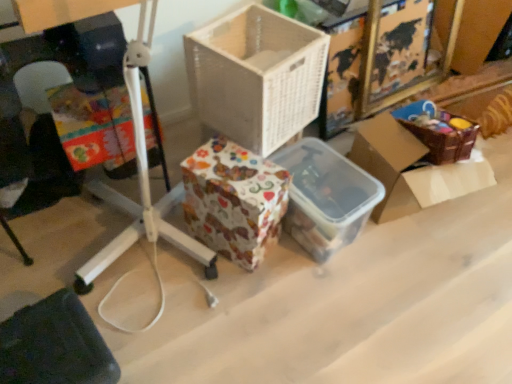
Image resolution: width=512 pixels, height=384 pixels. What are the coordinates of `free point in front of patterned paper storage box at center, positioned as the 2th storage box in right-to-left order` in the screenshot? It's located at (234, 295).